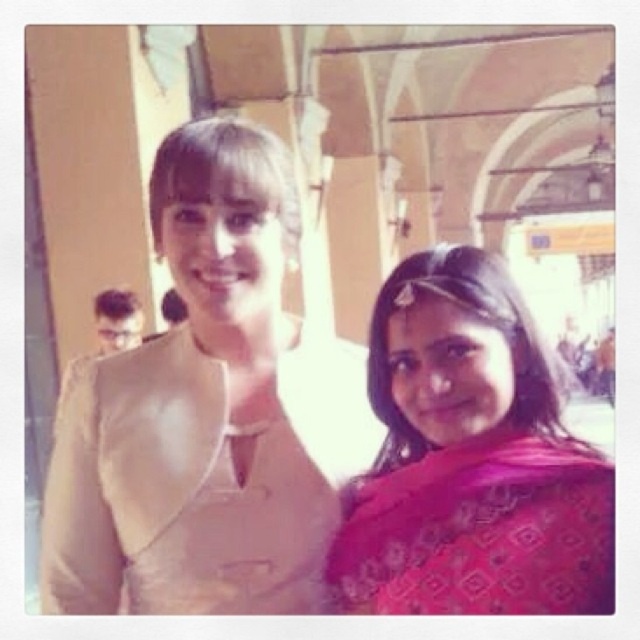
Question: Observing the image, what is the correct spatial positioning of beige fabric at center in reference to silky pink sari at right?

Choices:
 (A) above
 (B) below

Answer: (A)

Question: Observing the image, what is the correct spatial positioning of pink printed saree at right in reference to silky pink sari at right?

Choices:
 (A) below
 (B) above

Answer: (B)

Question: Which point is farther from the camera taking this photo?

Choices:
 (A) pyautogui.click(x=580, y=518)
 (B) pyautogui.click(x=342, y=600)
 (C) pyautogui.click(x=355, y=438)

Answer: (C)

Question: Which of the following is the closest to the observer?

Choices:
 (A) (545, 484)
 (B) (189, 413)
 (C) (595, 580)

Answer: (C)

Question: Is pink printed saree at right bigger than silky pink sari at right?

Choices:
 (A) no
 (B) yes

Answer: (B)

Question: Which point is closer to the camera?

Choices:
 (A) (428, 604)
 (B) (157, 221)

Answer: (A)